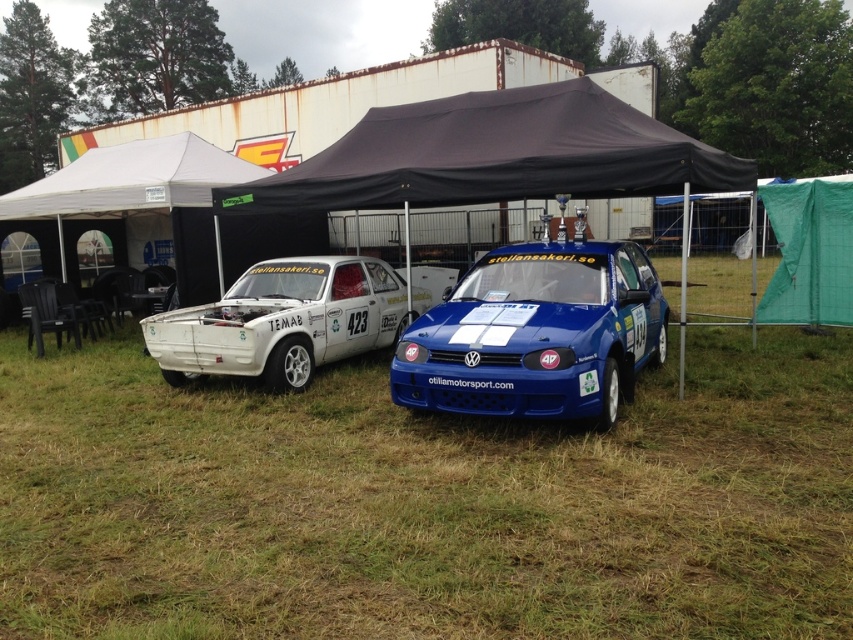
You are standing in front of the two rally cars under the canopy. You notice the green grass at center and the blue glossy hatchback at center. Which object is nearer to you?

The green grass at center is closer to the viewer than the blue glossy hatchback at center.